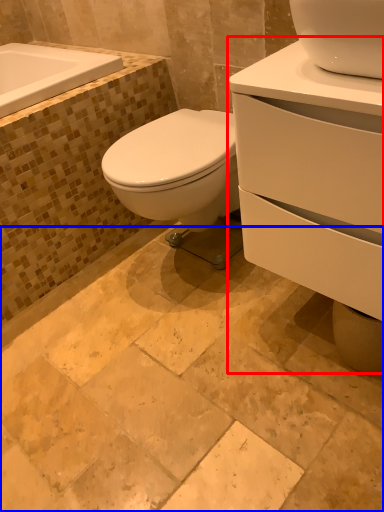
Question: Among these objects, which one is farthest to the camera, porcelain (highlighted by a red box) or ceramic tile (highlighted by a blue box)?

Choices:
 (A) porcelain
 (B) ceramic tile

Answer: (A)